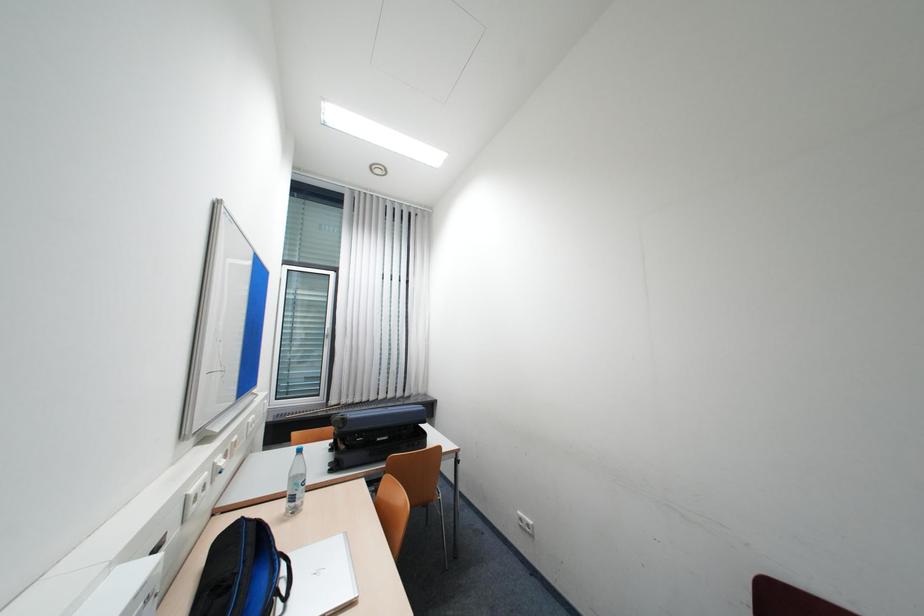
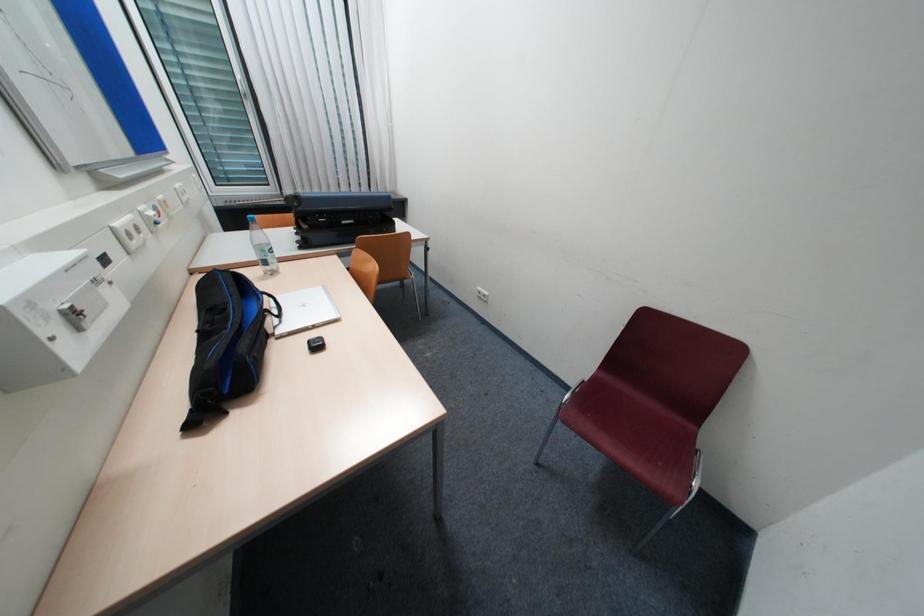
Question: The images are taken continuously from a first-person perspective. In which direction is your viewpoint rotating?

Choices:
 (A) Left
 (B) Right
 (C) Up
 (D) Down

Answer: (D)